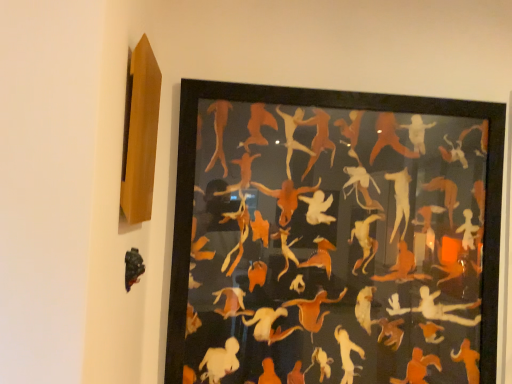
Question: Is orange matte paper cutouts at center beside black matte sculpture at lower left?

Choices:
 (A) no
 (B) yes

Answer: (A)

Question: From the image's perspective, is orange matte paper cutouts at center on top of black matte sculpture at lower left?

Choices:
 (A) no
 (B) yes

Answer: (B)

Question: Is orange matte paper cutouts at center further to the viewer compared to black matte sculpture at lower left?

Choices:
 (A) no
 (B) yes

Answer: (B)

Question: Is orange matte paper cutouts at center not inside black matte sculpture at lower left?

Choices:
 (A) yes
 (B) no

Answer: (A)

Question: Is orange matte paper cutouts at center at the right side of black matte sculpture at lower left?

Choices:
 (A) yes
 (B) no

Answer: (A)

Question: Considering the relative positions of orange matte paper cutouts at center and black matte sculpture at lower left in the image provided, is orange matte paper cutouts at center to the left of black matte sculpture at lower left from the viewer's perspective?

Choices:
 (A) yes
 (B) no

Answer: (B)

Question: Is black matte sculpture at lower left positioned with its back to orange matte paper cutouts at center?

Choices:
 (A) yes
 (B) no

Answer: (B)

Question: From a real-world perspective, is black matte sculpture at lower left below orange matte paper cutouts at center?

Choices:
 (A) yes
 (B) no

Answer: (A)

Question: Is black matte sculpture at lower left in front of orange matte paper cutouts at center?

Choices:
 (A) yes
 (B) no

Answer: (A)

Question: Does black matte sculpture at lower left appear on the left side of orange matte paper cutouts at center?

Choices:
 (A) yes
 (B) no

Answer: (A)

Question: From the image's perspective, would you say black matte sculpture at lower left is shown under orange matte paper cutouts at center?

Choices:
 (A) yes
 (B) no

Answer: (A)

Question: Considering the relative sizes of black matte sculpture at lower left and orange matte paper cutouts at center in the image provided, is black matte sculpture at lower left smaller than orange matte paper cutouts at center?

Choices:
 (A) no
 (B) yes

Answer: (B)

Question: Is black matte sculpture at lower left bigger or smaller than orange matte paper cutouts at center?

Choices:
 (A) small
 (B) big

Answer: (A)